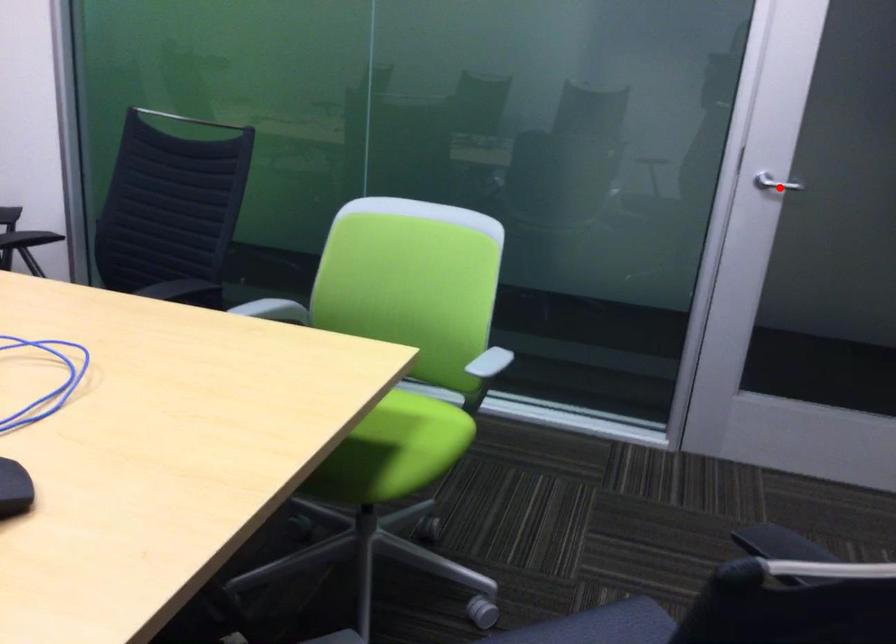
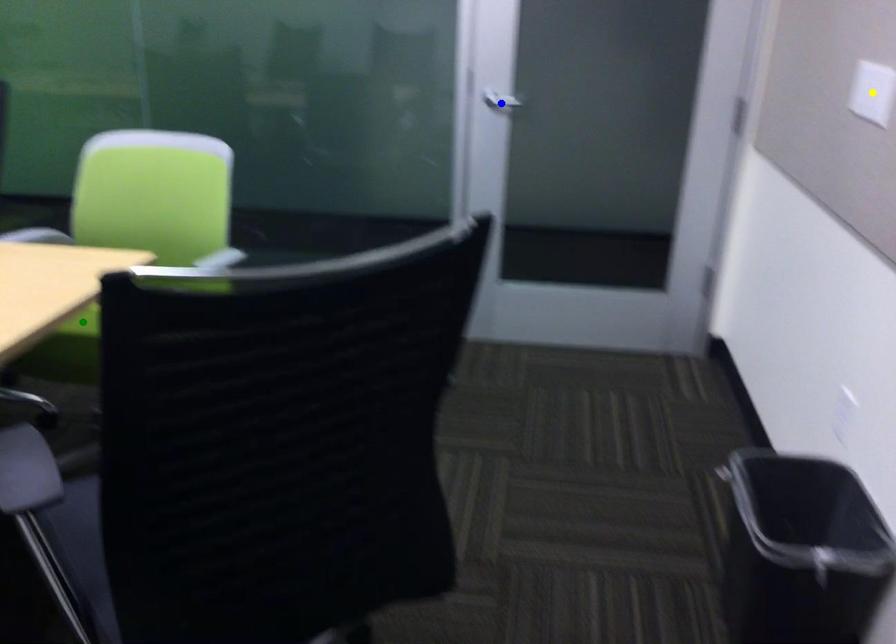
Question: I am providing you with two images of the same scene from different viewpoints. A red point is marked on the first image. You are given multiple points on the second image. Which mark in image 2 goes with the point in image 1?

Choices:
 (A) yellow point
 (B) blue point
 (C) green point

Answer: (B)